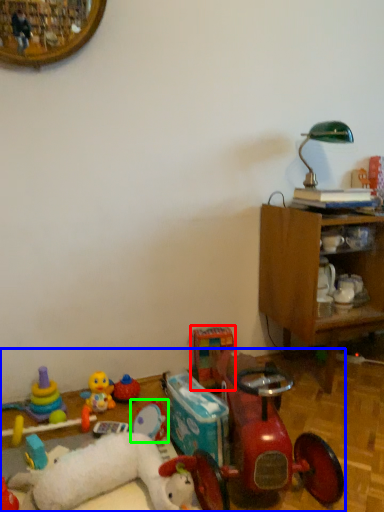
Question: Based on their relative distances, which object is farther from toy (highlighted by a red box)? Choose from toy (highlighted by a blue box) and toy (highlighted by a green box).

Choices:
 (A) toy
 (B) toy

Answer: (A)